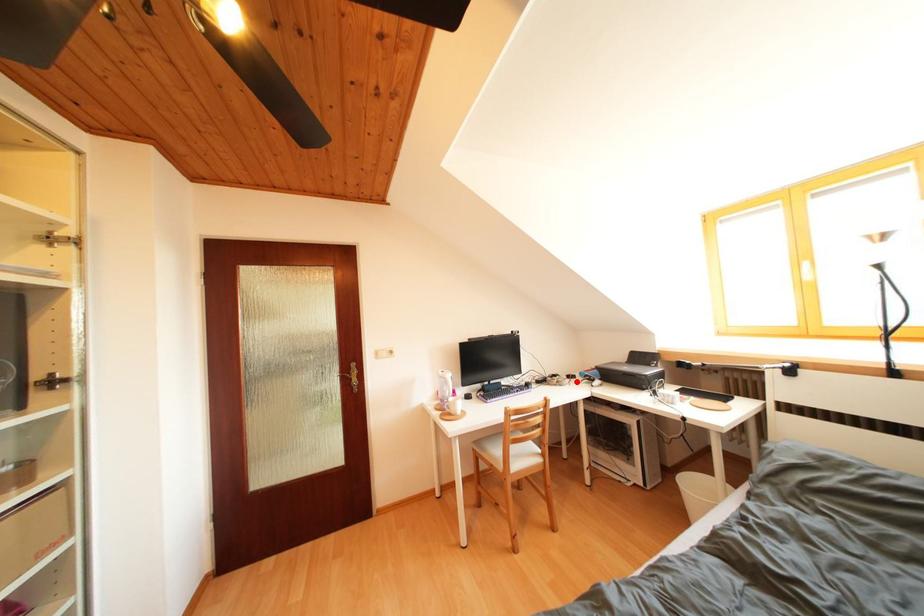
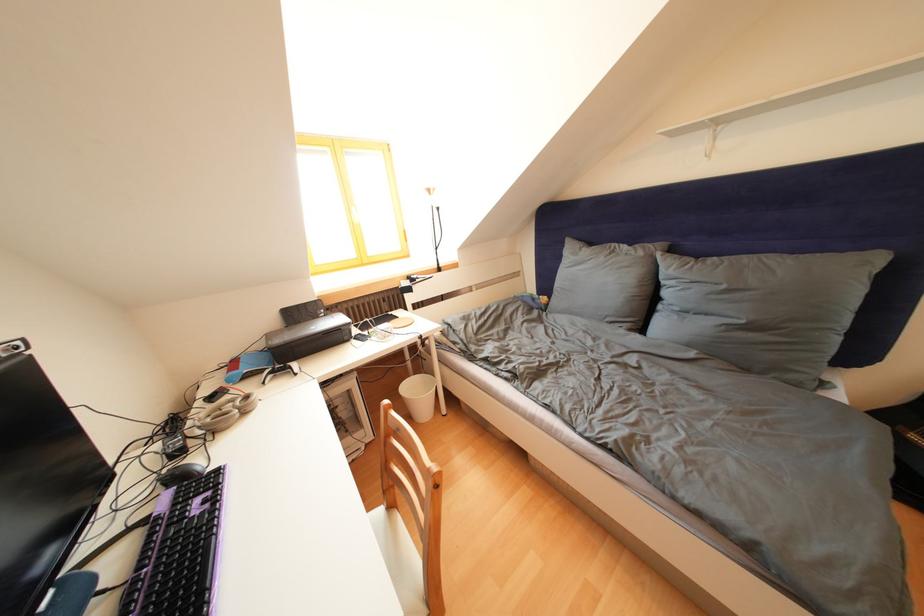
Find the pixel in the second image that matches the highlighted location in the first image.

(220, 403)